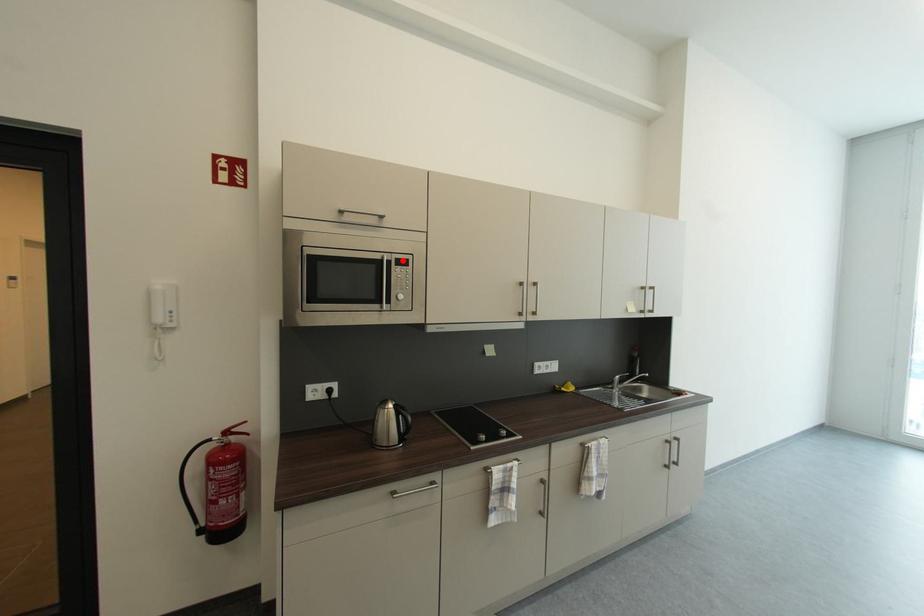
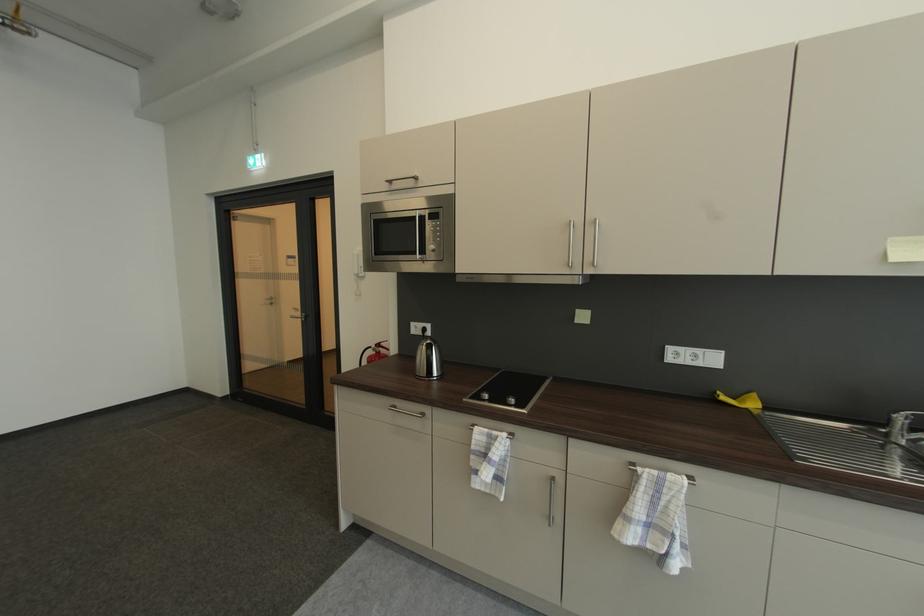
Locate, in the second image, the point that corresponds to the highlighted location in the first image.

(436, 215)